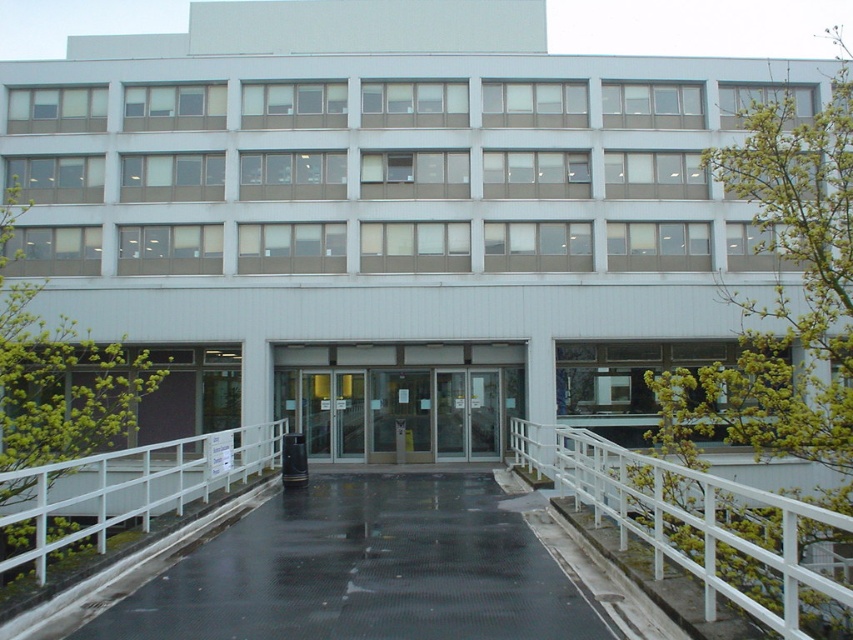
Question: Can you confirm if black rubber path at center is thinner than white metal railing at center?

Choices:
 (A) yes
 (B) no

Answer: (A)

Question: Which of the following is the closest to the observer?

Choices:
 (A) white metal railing at center
 (B) black rubber path at center
 (C) white metal rail at lower left
 (D) transparent glass doors at center

Answer: (A)

Question: Which of the following is the closest to the observer?

Choices:
 (A) [430, 408]
 (B) [428, 524]
 (C) [33, 470]

Answer: (C)

Question: Where is transparent glass doors at center located in relation to white metal rail at lower left in the image?

Choices:
 (A) left
 (B) right

Answer: (B)

Question: Considering the relative positions of black rubber path at center and transparent glass doors at center in the image provided, where is black rubber path at center located with respect to transparent glass doors at center?

Choices:
 (A) left
 (B) right

Answer: (B)

Question: Which point appears farthest from the camera in this image?

Choices:
 (A) tap(851, 588)
 (B) tap(115, 481)
 (C) tap(480, 445)
 (D) tap(511, 602)

Answer: (C)